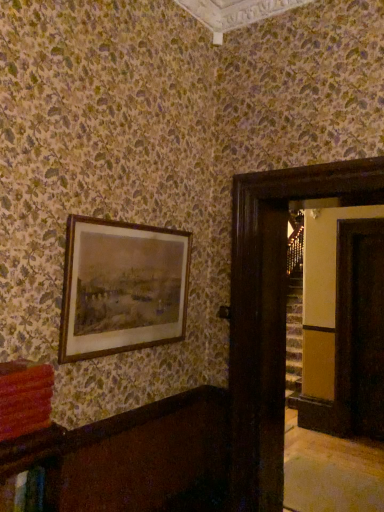
Question: Can you confirm if brown wooden picture frame at upper left is shorter than transparent glass door at right, which ranks as the 1th glass door in back-to-front order?

Choices:
 (A) no
 (B) yes

Answer: (B)

Question: Is brown wooden picture frame at upper left to the left of transparent glass door at right, the second glass door from the left, from the viewer's perspective?

Choices:
 (A) no
 (B) yes

Answer: (B)

Question: From the image's perspective, is brown wooden picture frame at upper left located beneath transparent glass door at right, the second glass door from the left?

Choices:
 (A) no
 (B) yes

Answer: (A)

Question: Is brown wooden picture frame at upper left looking in the opposite direction of transparent glass door at right, arranged as the first glass door when viewed from the right?

Choices:
 (A) no
 (B) yes

Answer: (A)

Question: From a real-world perspective, is brown wooden picture frame at upper left beneath transparent glass door at right, the second glass door from the left?

Choices:
 (A) no
 (B) yes

Answer: (A)

Question: Can you confirm if brown wooden picture frame at upper left is positioned to the right of transparent glass door at right, which ranks as the 1th glass door in back-to-front order?

Choices:
 (A) no
 (B) yes

Answer: (A)

Question: Is brown wooden picture frame at upper left smaller than matte red book at lower left?

Choices:
 (A) yes
 (B) no

Answer: (B)

Question: Does brown wooden picture frame at upper left have a lesser height compared to matte red book at lower left?

Choices:
 (A) no
 (B) yes

Answer: (A)

Question: Is matte red book at lower left inside brown wooden picture frame at upper left?

Choices:
 (A) yes
 (B) no

Answer: (B)

Question: Is brown wooden picture frame at upper left at the left side of matte red book at lower left?

Choices:
 (A) no
 (B) yes

Answer: (A)

Question: Is brown wooden picture frame at upper left positioned far away from matte red book at lower left?

Choices:
 (A) yes
 (B) no

Answer: (B)

Question: Is brown wooden picture frame at upper left next to matte red book at lower left and touching it?

Choices:
 (A) no
 (B) yes

Answer: (A)

Question: Considering the relative sizes of matte red book at lower left and dark wood door at right, which ranks as the 2th glass door in right-to-left order, in the image provided, is matte red book at lower left thinner than dark wood door at right, which ranks as the 2th glass door in right-to-left order,?

Choices:
 (A) no
 (B) yes

Answer: (B)